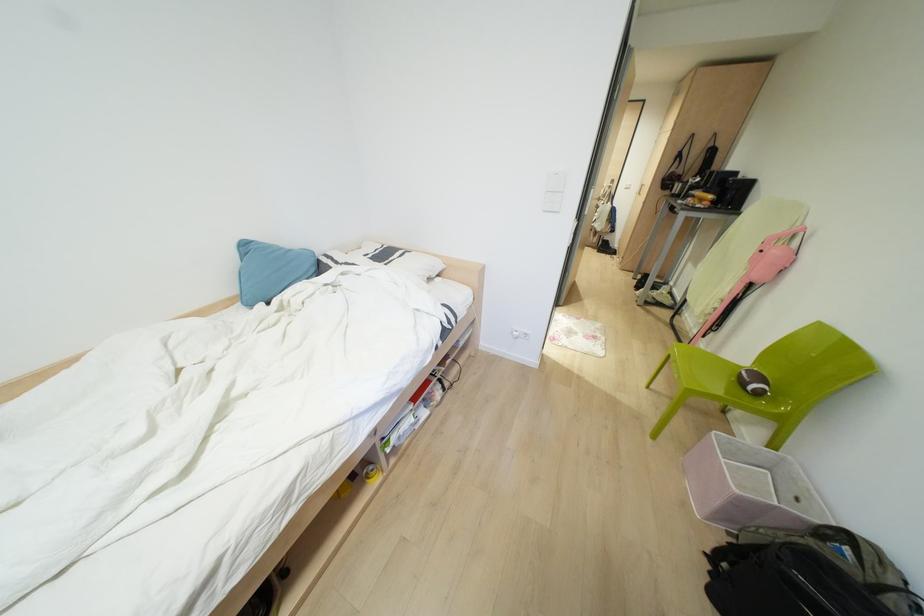
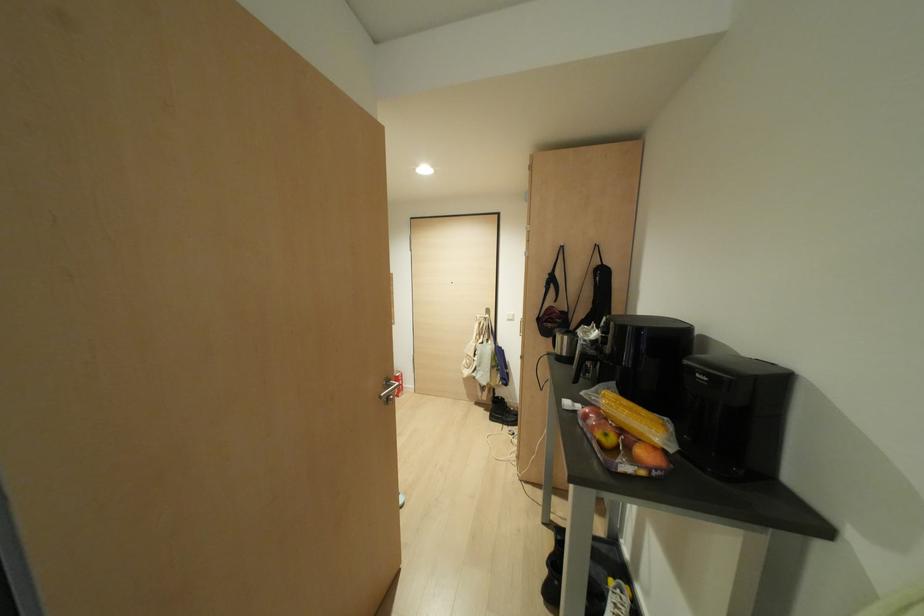
Find the pixel in the second image that matches [678,155] in the first image.

(551, 280)